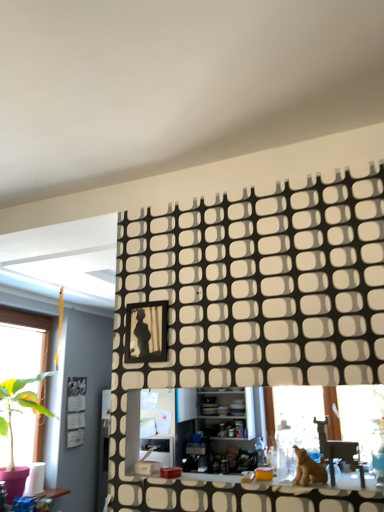
Question: Is black textured wall panel at upper center in front of metallic silver swivel chair at lower right?

Choices:
 (A) no
 (B) yes

Answer: (B)

Question: From a real-world perspective, is black textured wall panel at upper center located beneath metallic silver swivel chair at lower right?

Choices:
 (A) yes
 (B) no

Answer: (B)

Question: Is black textured wall panel at upper center turned away from metallic silver swivel chair at lower right?

Choices:
 (A) yes
 (B) no

Answer: (A)

Question: Is black textured wall panel at upper center far from metallic silver swivel chair at lower right?

Choices:
 (A) no
 (B) yes

Answer: (A)

Question: Does black textured wall panel at upper center have a greater height compared to metallic silver swivel chair at lower right?

Choices:
 (A) no
 (B) yes

Answer: (B)

Question: Is metallic silver swivel chair at lower right a part of black textured wall panel at upper center?

Choices:
 (A) no
 (B) yes

Answer: (A)

Question: From the image's perspective, is metallic silver swivel chair at lower right located above black textured wall panel at upper center?

Choices:
 (A) no
 (B) yes

Answer: (A)

Question: Considering the relative sizes of metallic silver swivel chair at lower right and black textured wall panel at upper center in the image provided, is metallic silver swivel chair at lower right shorter than black textured wall panel at upper center?

Choices:
 (A) yes
 (B) no

Answer: (A)

Question: From a real-world perspective, is metallic silver swivel chair at lower right over black textured wall panel at upper center?

Choices:
 (A) no
 (B) yes

Answer: (A)

Question: Is metallic silver swivel chair at lower right wider than black textured wall panel at upper center?

Choices:
 (A) yes
 (B) no

Answer: (A)

Question: Are metallic silver swivel chair at lower right and black textured wall panel at upper center located far from each other?

Choices:
 (A) yes
 (B) no

Answer: (B)

Question: Is black textured wall panel at upper center surrounded by metallic silver swivel chair at lower right?

Choices:
 (A) yes
 (B) no

Answer: (B)

Question: From a real-world perspective, is white glossy counter top at center located higher than brown furry dog at lower right?

Choices:
 (A) yes
 (B) no

Answer: (B)